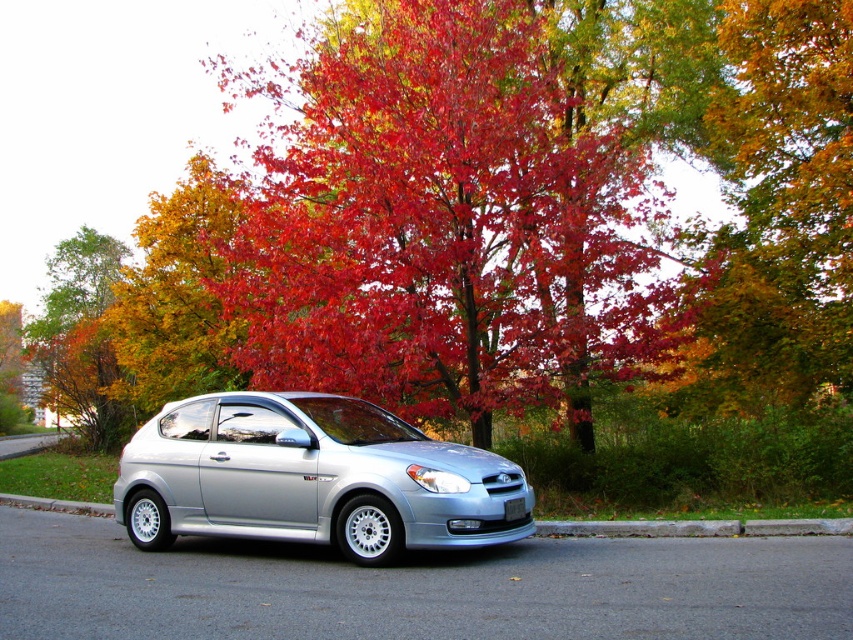
Question: Which point appears farthest from the camera in this image?

Choices:
 (A) (195, 224)
 (B) (138, 508)
 (C) (334, 58)

Answer: (A)

Question: In this image, where is satin silver car at center located relative to gray concrete curb at lower center?

Choices:
 (A) right
 (B) left

Answer: (A)

Question: Which of the following is the closest to the observer?

Choices:
 (A) (601, 520)
 (B) (560, 80)
 (C) (345, 470)

Answer: (C)

Question: Among these objects, which one is nearest to the camera?

Choices:
 (A) white plastic license plate at center
 (B) gray concrete curb at lower center
 (C) vivid red leaves at center
 (D) autumn leaves at center

Answer: (A)

Question: In this image, where is satin silver car at center located relative to autumn leaves at center?

Choices:
 (A) right
 (B) left

Answer: (A)

Question: Does gray concrete curb at lower center have a lesser width compared to white plastic license plate at center?

Choices:
 (A) yes
 (B) no

Answer: (B)